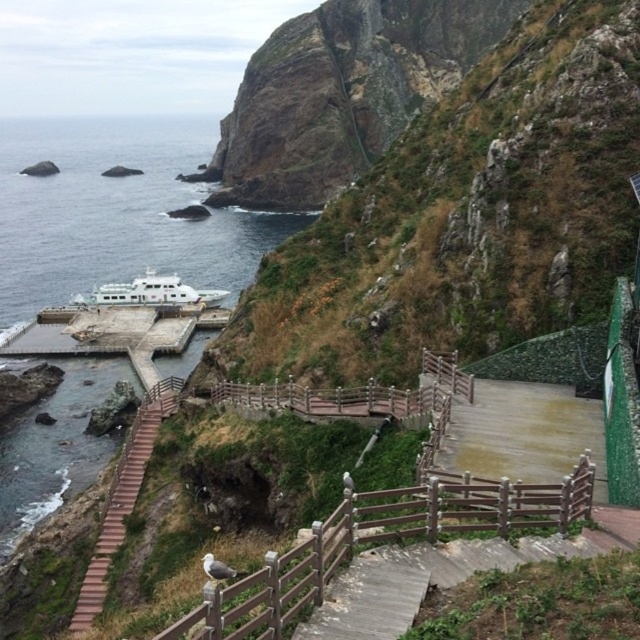
Question: Which of these objects is positioned closest to the blue water at lower left?

Choices:
 (A) white glossy cruise ship at lower left
 (B) green mossy rock at center
 (C) brown wooden rail at center

Answer: (A)

Question: Does blue water at lower left appear under brown wooden rail at center?

Choices:
 (A) yes
 (B) no

Answer: (B)

Question: Which object appears closest to the camera in this image?

Choices:
 (A) blue water at lower left
 (B) white glossy cruise ship at lower left
 (C) brown wooden rail at center

Answer: (C)

Question: Can you confirm if blue water at lower left is smaller than white glossy cruise ship at lower left?

Choices:
 (A) yes
 (B) no

Answer: (B)

Question: Which object is farther from the camera taking this photo?

Choices:
 (A) white glossy cruise ship at lower left
 (B) brown wooden rail at center
 (C) blue water at lower left

Answer: (A)

Question: Where is brown wooden rail at center located in relation to white glossy cruise ship at lower left in the image?

Choices:
 (A) left
 (B) right

Answer: (B)